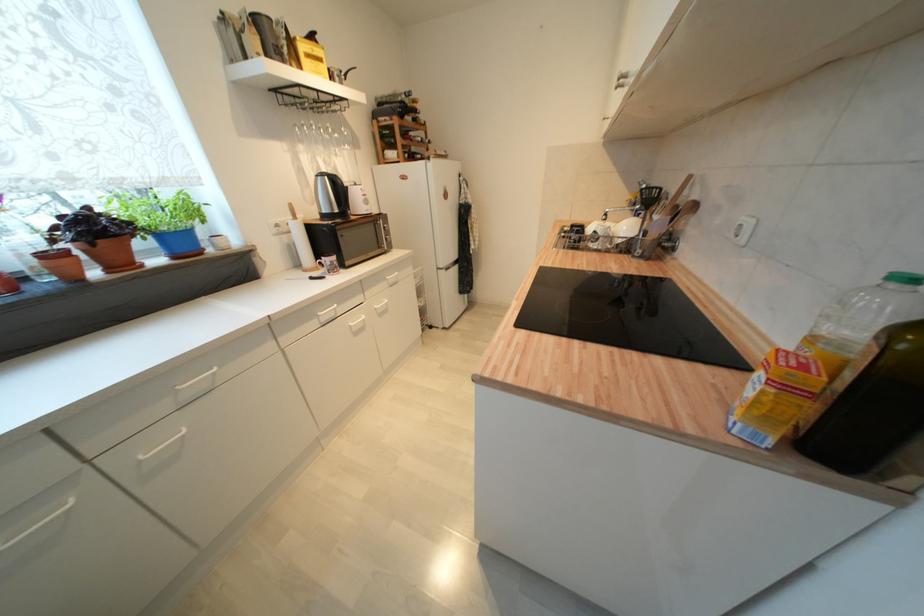
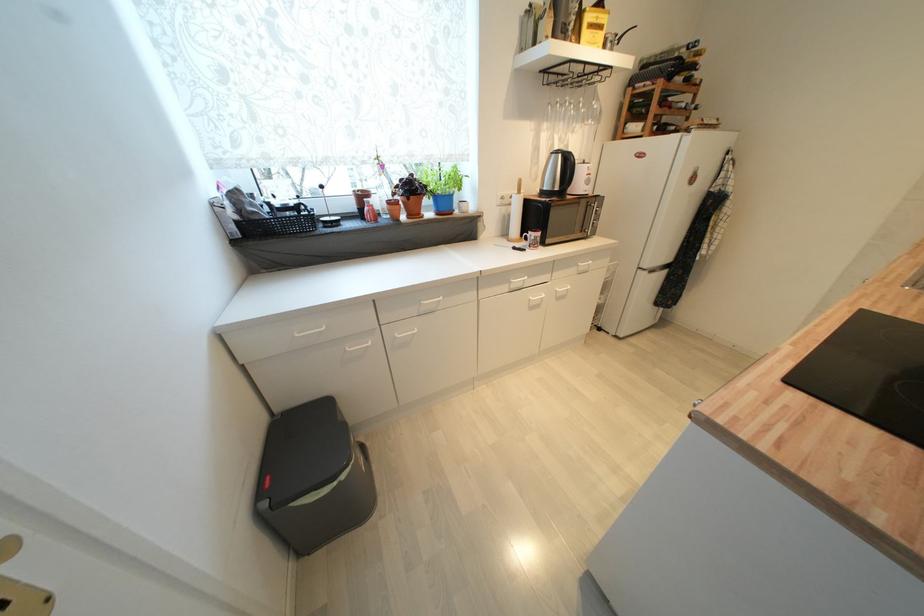
The point at (338, 134) is marked in the first image. Where is the corresponding point in the second image?

(589, 108)